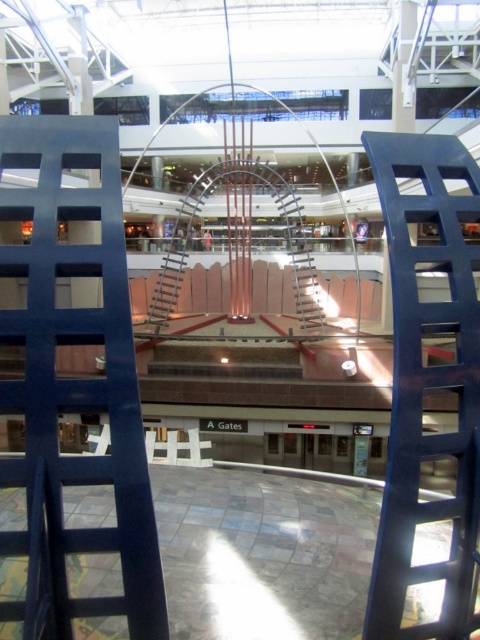
You are a maintenance worker needing to reach a high shelf in the mall. You see the polished stone floor at center and the blue metallic ladder at center. Which object can you use to climb?

The blue metallic ladder at center can be used to climb since ladders are designed for ascending and descending, while the polished stone floor at center is a flat surface not meant for climbing.

You are standing at the point marked as point (307, 531) in a large modern building with two blue film reel structures. The building has high ceilings and large glass windows. You want to take a photo of the entire scene. Is the distance between you and the camera sufficient to capture the entire view of the two blue film reel structures?

The distance between point (307, 531) and the camera is 10.79 meters. Since the two blue film reel structures are positioned on either side of the frame and the camera is 10.79 meters away, this distance should be sufficient to capture the entire view of both structures in the photo.

You are standing in the modern building and want to reach the top of the blue matte ladder at center. Considering the polished stone floor at center is at ground level, can you step onto the ladder from the floor?

Yes, you can step onto the blue matte ladder at center from the polished stone floor at center because the ladder is taller than the floor, meaning its base is accessible from the ground level.